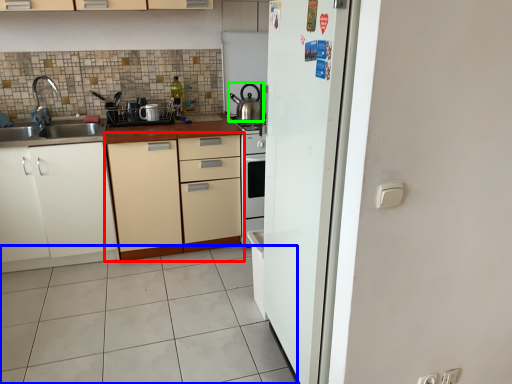
Question: Which object is the closest to the cabinetry (highlighted by a red box)? Choose among these: plain (highlighted by a blue box) or kitchen appliance (highlighted by a green box).

Choices:
 (A) plain
 (B) kitchen appliance

Answer: (A)